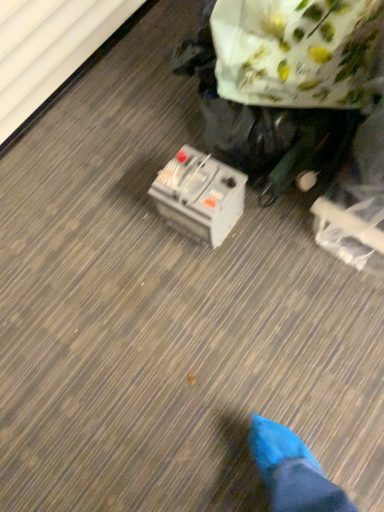
Question: From the image's perspective, is white floral paper bag at upper right positioned above or below gray plastic battery at center?

Choices:
 (A) below
 (B) above

Answer: (B)

Question: In terms of size, does white floral paper bag at upper right appear bigger or smaller than gray plastic battery at center?

Choices:
 (A) big
 (B) small

Answer: (A)

Question: Is white floral paper bag at upper right inside the boundaries of gray plastic battery at center, or outside?

Choices:
 (A) outside
 (B) inside

Answer: (A)

Question: From a real-world perspective, is gray plastic battery at center physically located above or below white floral paper bag at upper right?

Choices:
 (A) below
 (B) above

Answer: (A)

Question: From the image's perspective, is gray plastic battery at center positioned above or below white floral paper bag at upper right?

Choices:
 (A) above
 (B) below

Answer: (B)

Question: Would you say gray plastic battery at center is to the left or to the right of white floral paper bag at upper right in the picture?

Choices:
 (A) left
 (B) right

Answer: (A)

Question: Do you think gray plastic battery at center is within white floral paper bag at upper right, or outside of it?

Choices:
 (A) inside
 (B) outside

Answer: (B)